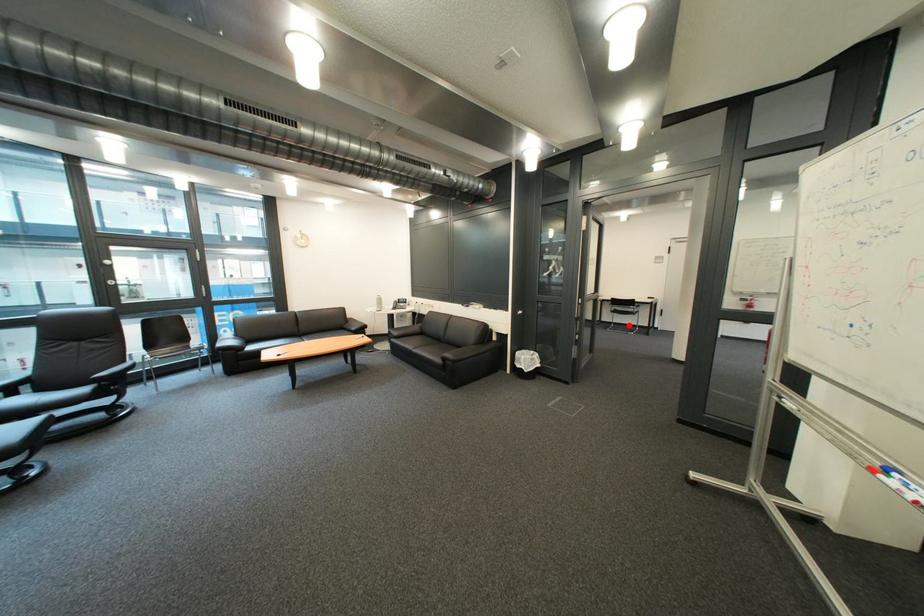
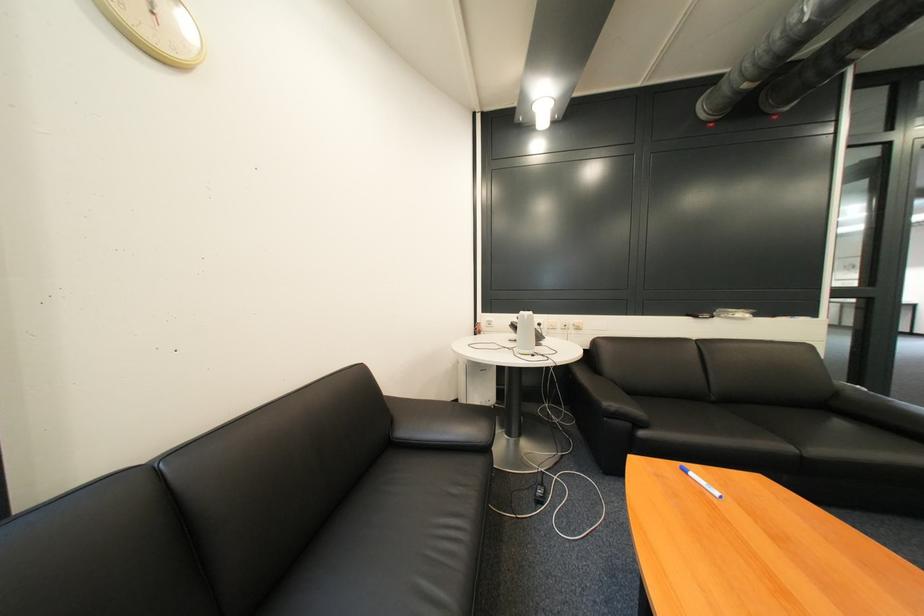
Question: I am providing you with two images of the same scene from different viewpoints. A red point is marked on the first image. Can you still see the location of the red point in image 2?

Choices:
 (A) Yes
 (B) No

Answer: (B)